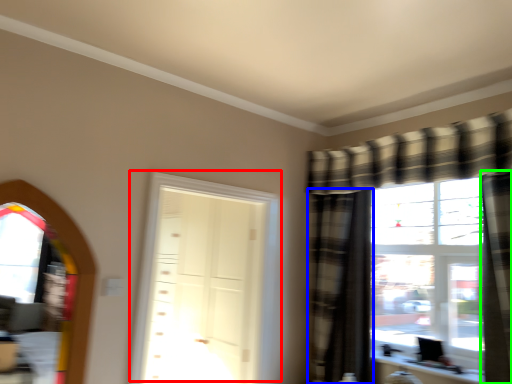
Question: Which is nearer to the door (highlighted by a red box)? curtain (highlighted by a blue box) or curtain (highlighted by a green box).

Choices:
 (A) curtain
 (B) curtain

Answer: (A)